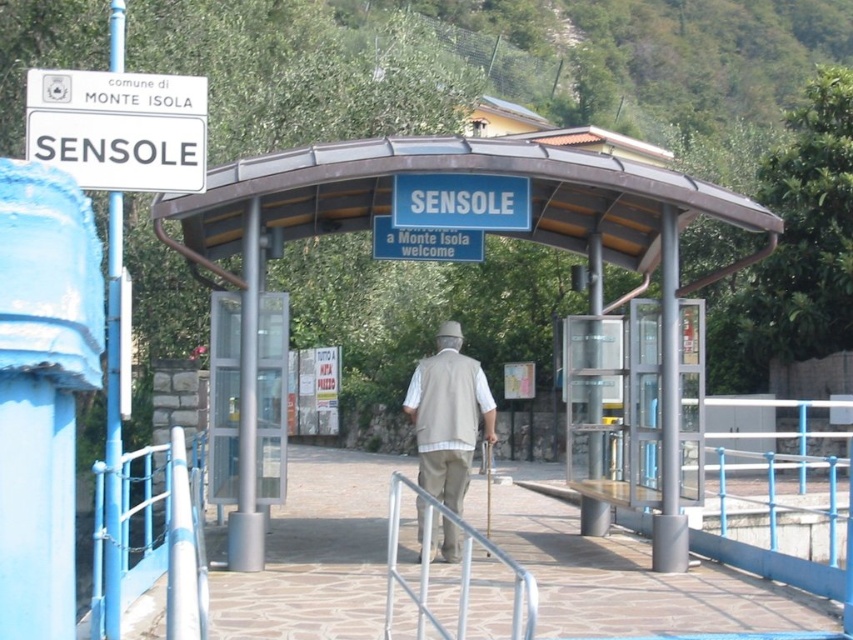
Question: Which point is closer to the camera taking this photo?

Choices:
 (A) (527, 588)
 (B) (494, 440)
 (C) (639, 264)

Answer: (A)

Question: Among these objects, which one is nearest to the camera?

Choices:
 (A) metallic silver bus stop at center
 (B) silver metallic railing at center
 (C) white plastic sign at upper left
 (D) beige fabric vest at center

Answer: (C)

Question: Can you confirm if metallic silver bus stop at center is positioned above silver metallic railing at center?

Choices:
 (A) no
 (B) yes

Answer: (B)

Question: Which is nearer to the silver metallic railing at center?

Choices:
 (A) beige fabric vest at center
 (B) white plastic sign at upper left

Answer: (A)

Question: Can you confirm if metallic silver bus stop at center is smaller than white plastic sign at upper left?

Choices:
 (A) no
 (B) yes

Answer: (B)

Question: Is metallic silver bus stop at center thinner than white plastic sign at upper left?

Choices:
 (A) yes
 (B) no

Answer: (B)